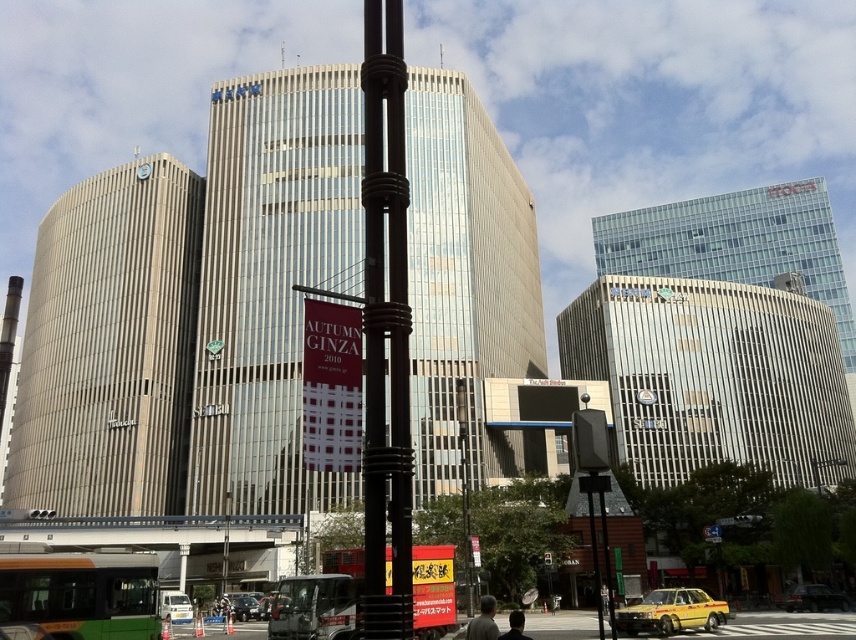
Question: Does shiny black sedan at lower right appear on the left side of metallic silver car at center?

Choices:
 (A) no
 (B) yes

Answer: (A)

Question: Which point is closer to the camera?

Choices:
 (A) (817, 467)
 (B) (390, 314)
 (C) (162, 605)
 (D) (795, 586)

Answer: (B)

Question: Is black matte pole at center bigger than metallic silver bus at lower center?

Choices:
 (A) no
 (B) yes

Answer: (B)

Question: Which of these objects is positioned farthest from the yellow matte taxi at lower right?

Choices:
 (A) metallic silver bus at lower center
 (B) black metal pole at center
 (C) black matte pole at center
 (D) shiny black sedan at lower right

Answer: (B)

Question: Can you confirm if black matte pole at center is wider than white matte van at center?

Choices:
 (A) yes
 (B) no

Answer: (B)

Question: Which point is farther from the camera taking this photo?

Choices:
 (A) 373,205
 (B) 19,579
 (C) 188,598

Answer: (C)